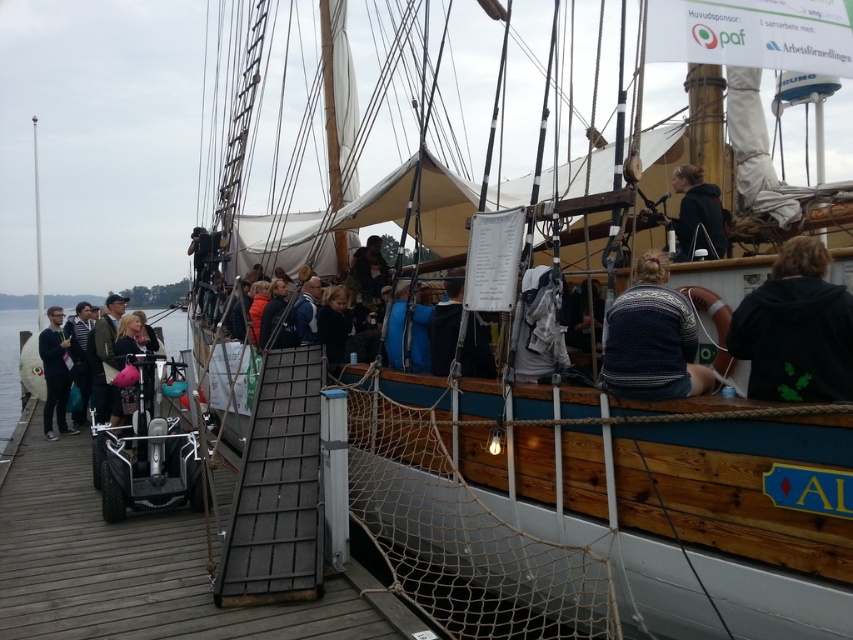
Question: Is metallic gray ramp at center positioned in front of dark gray fabric jacket at left?

Choices:
 (A) yes
 (B) no

Answer: (A)

Question: Which object is the farthest from the white wood mast at upper center?

Choices:
 (A) knitted sweater at center
 (B) dark gray fabric jacket at left
 (C) dark blue sweater at upper center

Answer: (A)

Question: Estimate the real-world distances between objects in this image. Which object is farther from the dark gray fabric jacket at left?

Choices:
 (A) matte black jacket at left
 (B) dark blue sweater at upper center
 (C) black hoodie at right

Answer: (C)

Question: Which of these objects is positioned farthest from the metallic gray ramp at center?

Choices:
 (A) knitted sweater at center
 (B) dark brown leather jacket at center

Answer: (B)

Question: Does clear blue water at lower left have a smaller size compared to dark gray fabric jacket at left?

Choices:
 (A) no
 (B) yes

Answer: (A)

Question: Does metallic gray ramp at center come behind dark blue sweater at upper center?

Choices:
 (A) no
 (B) yes

Answer: (A)